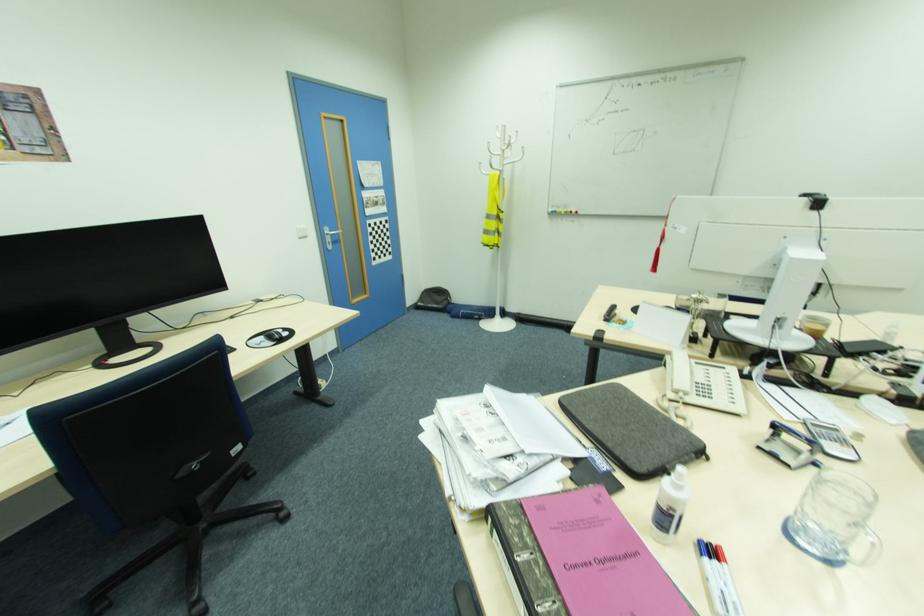
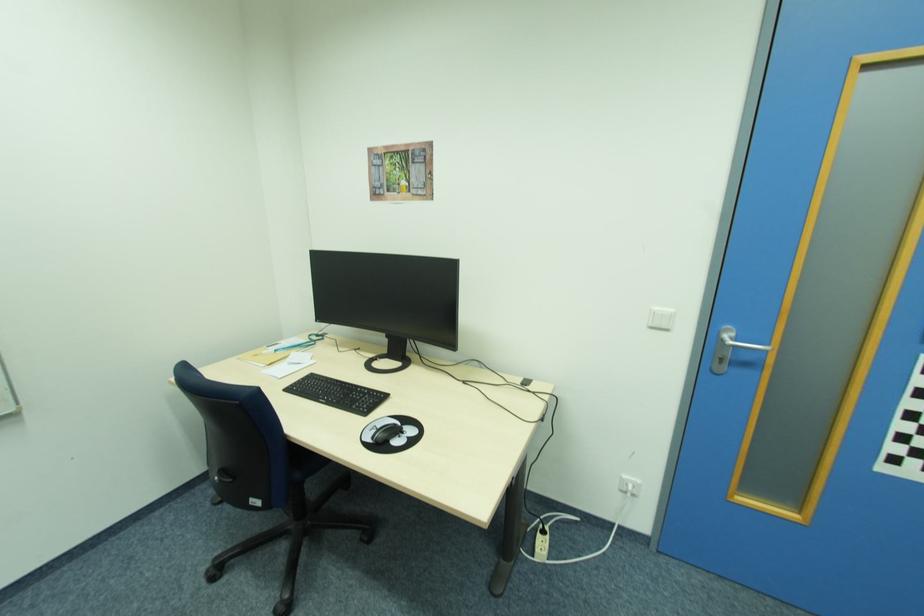
Locate, in the second image, the point that corresponds to point 276,342 in the first image.

(372, 440)